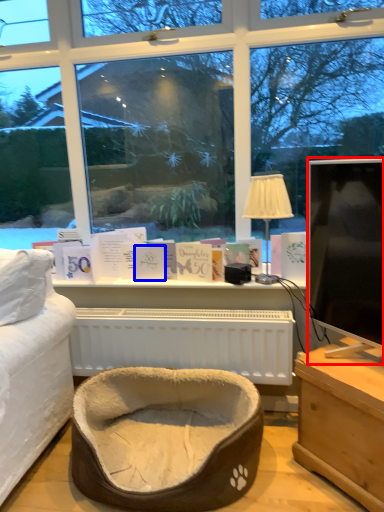
Question: Which object appears closest to the camera in this image, television (highlighted by a red box) or book (highlighted by a blue box)?

Choices:
 (A) television
 (B) book

Answer: (A)